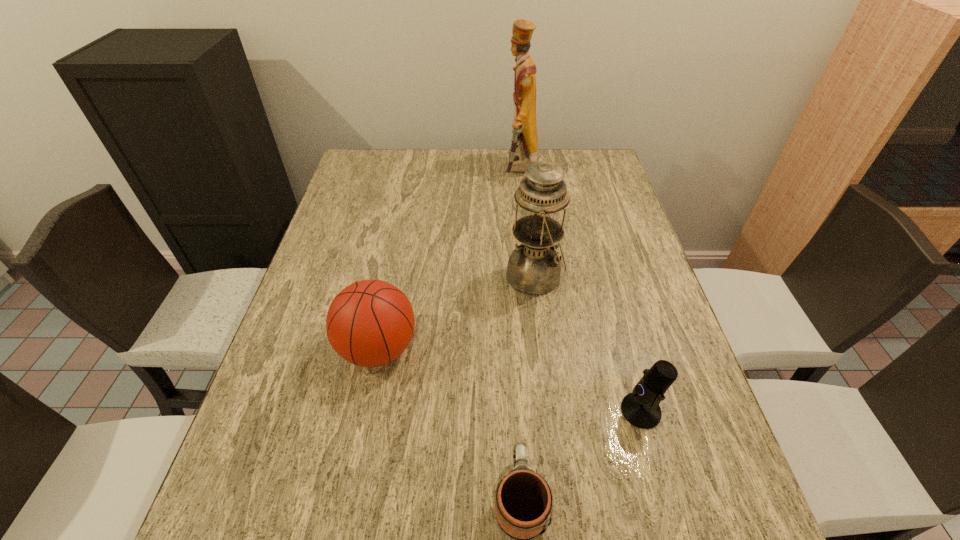
This screenshot has height=540, width=960. I want to click on vacant space located on the front-facing side of the tallest object, so click(478, 170).

The width and height of the screenshot is (960, 540). I want to click on vacant space located 0.390m on the left of the second farthest object, so click(356, 276).

Where is `vacant area situated on the back of the basketball`? vacant area situated on the back of the basketball is located at coordinates (396, 258).

Locate an element on the screen. vacant space situated on the stand of the fourth farthest object is located at coordinates (511, 411).

Where is `vacant region located 0.220m on the stand of the fourth farthest object`? Image resolution: width=960 pixels, height=540 pixels. vacant region located 0.220m on the stand of the fourth farthest object is located at coordinates (511, 411).

This screenshot has width=960, height=540. What are the coordinates of `free space located on the stand of the fourth farthest object` in the screenshot? It's located at (526, 411).

This screenshot has width=960, height=540. I want to click on object present at the far edge, so click(x=523, y=152).

What are the coordinates of `object that is at the left edge` in the screenshot? It's located at (370, 323).

Locate an element on the screen. object present at the right edge is located at coordinates (640, 408).

Find the location of a particular element. The height and width of the screenshot is (540, 960). free location at the far edge is located at coordinates (402, 180).